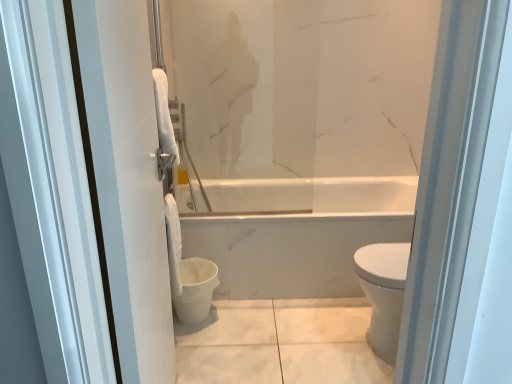
I want to click on blank space situated above white matte toilet bowl at lower center (from a real-world perspective), so click(x=192, y=264).